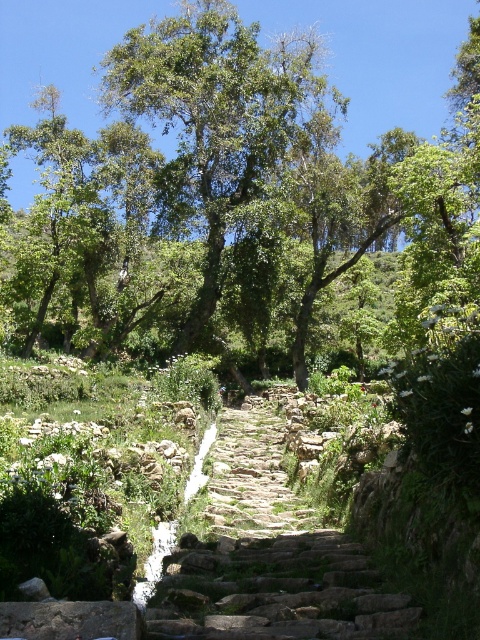
Question: Is green leafy tree at center behind rusty stone stairs at center?

Choices:
 (A) yes
 (B) no

Answer: (A)

Question: Which point is farther to the camera?

Choices:
 (A) (192, 88)
 (B) (172, 4)

Answer: (B)

Question: Considering the relative positions of green leafy tree at center and rusty stone stairs at center in the image provided, where is green leafy tree at center located with respect to rusty stone stairs at center?

Choices:
 (A) left
 (B) right

Answer: (B)

Question: Can you confirm if green leafy tree at center is positioned below rusty stone stairs at center?

Choices:
 (A) no
 (B) yes

Answer: (A)

Question: Which object is closer to the camera taking this photo?

Choices:
 (A) rusty stone stairs at center
 (B) green leafy tree at center
 (C) green leafy tree at upper center

Answer: (A)

Question: Which point is closer to the camera taking this photo?

Choices:
 (A) 229,628
 (B) 216,4
 (C) 107,17

Answer: (A)